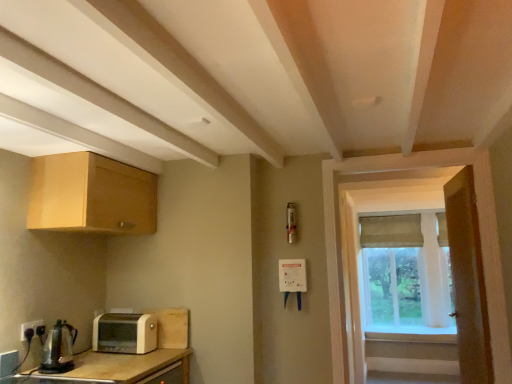
What do you see at coordinates (339, 230) in the screenshot? The height and width of the screenshot is (384, 512). I see `wooden screen door at right` at bounding box center [339, 230].

Where is `white plastic toaster at lower left`? white plastic toaster at lower left is located at coordinates (125, 333).

Locate an element on the screen. This screenshot has width=512, height=384. green fabric curtain at right is located at coordinates (406, 274).

What do you see at coordinates (29, 327) in the screenshot? The width and height of the screenshot is (512, 384). I see `black plastic electrical outlet at lower left` at bounding box center [29, 327].

From the picture: In order to face wooden door at right, should I rotate leftwards or rightwards?

Rotate right and turn 25.791 degrees.

What do you see at coordinates (391, 231) in the screenshot? The image size is (512, 384). I see `beige fabric curtain at window` at bounding box center [391, 231].

This screenshot has width=512, height=384. What do you see at coordinates (58, 349) in the screenshot? I see `translucent glass kettle at lower left` at bounding box center [58, 349].

In order to click on wooden screen door at right in this screenshot , I will do `click(339, 230)`.

Can we say translucent glass kettle at lower left lies outside light wood cabinet at upper left?

translucent glass kettle at lower left is positioned outside light wood cabinet at upper left.

How distant is translucent glass kettle at lower left from light wood cabinet at upper left?

translucent glass kettle at lower left is 28.16 inches away from light wood cabinet at upper left.

Where is `coffee machine below the light wood cabinet at upper left (from the image's perspective)`? This screenshot has width=512, height=384. coffee machine below the light wood cabinet at upper left (from the image's perspective) is located at coordinates click(58, 349).

Considering the relative sizes of translucent glass kettle at lower left and light wood cabinet at upper left in the image provided, is translucent glass kettle at lower left thinner than light wood cabinet at upper left?

Correct, the width of translucent glass kettle at lower left is less than that of light wood cabinet at upper left.

How different are the orientations of wooden screen door at right and green fabric curtain at right in degrees?

wooden screen door at right and green fabric curtain at right are facing 4.34 degrees away from each other.

Which is more to the left, wooden screen door at right or green fabric curtain at right?

Positioned to the left is wooden screen door at right.

Is wooden screen door at right with green fabric curtain at right?

No, wooden screen door at right is not touching green fabric curtain at right.

Is wooden screen door at right shorter than green fabric curtain at right?

Indeed, wooden screen door at right has a lesser height compared to green fabric curtain at right.

Is light wood cabinet at upper left looking in the opposite direction of wooden door at right?

light wood cabinet at upper left does not have its back to wooden door at right.

Is light wood cabinet at upper left in front of wooden door at right?

Yes.

Considering the relative sizes of light wood cabinet at upper left and wooden door at right in the image provided, is light wood cabinet at upper left wider than wooden door at right?

Indeed, light wood cabinet at upper left has a greater width compared to wooden door at right.

Is point (102, 196) closer or farther from the camera than point (459, 325)?

Point (102, 196).

Considering the sizes of green fabric curtain at right and light wood cabinet at upper left in the image, is green fabric curtain at right wider or thinner than light wood cabinet at upper left?

green fabric curtain at right is thinner than light wood cabinet at upper left.

Is green fabric curtain at right smaller than light wood cabinet at upper left?

No, green fabric curtain at right is not smaller than light wood cabinet at upper left.

From a real-world perspective, is green fabric curtain at right above or below light wood cabinet at upper left?

In terms of real-world spatial position, green fabric curtain at right is below light wood cabinet at upper left.

Is translucent glass kettle at lower left facing towards wooden screen door at right?

Yes, translucent glass kettle at lower left is facing wooden screen door at right.

Can you confirm if translucent glass kettle at lower left is positioned to the right of wooden screen door at right?

No, translucent glass kettle at lower left is not to the right of wooden screen door at right.

Which is in front, point (72, 359) or point (469, 159)?

The point (72, 359) is in front.

I want to click on coffee machine in front of the wooden screen door at right, so click(58, 349).

Does point (29, 327) lie behind point (145, 173)?

That is False.

Is black plastic electrical outlet at lower left spatially inside light wood cabinet at upper left, or outside of it?

black plastic electrical outlet at lower left is not enclosed by light wood cabinet at upper left.

Considering the sizes of black plastic electrical outlet at lower left and light wood cabinet at upper left in the image, is black plastic electrical outlet at lower left wider or thinner than light wood cabinet at upper left?

Considering their sizes, black plastic electrical outlet at lower left looks slimmer than light wood cabinet at upper left.

Considering the relative positions of black plastic electrical outlet at lower left and light wood cabinet at upper left in the image provided, is black plastic electrical outlet at lower left to the left or to the right of light wood cabinet at upper left?

From the image, it's evident that black plastic electrical outlet at lower left is to the left of light wood cabinet at upper left.

In terms of height, does black plastic electrical outlet at lower left look taller or shorter compared to translucent glass kettle at lower left?

In the image, black plastic electrical outlet at lower left appears to be shorter than translucent glass kettle at lower left.

In the image, there is a black plastic electrical outlet at lower left. Identify the location of coffee machine below it (from the image's perspective). This screenshot has width=512, height=384. (58, 349).

Between black plastic electrical outlet at lower left and translucent glass kettle at lower left, which one is positioned in front?

translucent glass kettle at lower left.

From a real-world perspective, is black plastic electrical outlet at lower left above or below translucent glass kettle at lower left?

In terms of real-world spatial position, black plastic electrical outlet at lower left is above translucent glass kettle at lower left.

The height and width of the screenshot is (384, 512). I want to click on cabinetry behind the translucent glass kettle at lower left, so click(x=91, y=195).

Locate an element on the screen. This screenshot has width=512, height=384. window that is below the wooden screen door at right (from the image's perspective) is located at coordinates (406, 274).

When comparing their distances from wooden door at right, does translucent glass kettle at lower left or wooden screen door at right seem further?

translucent glass kettle at lower left.

Looking at the image, which one is located further to wooden door at right, translucent glass kettle at lower left or beige fabric curtain at window?

translucent glass kettle at lower left is positioned further to the anchor wooden door at right.

Looking at this image, considering their positions, is wooden door at right positioned further to light wood cabinet at upper left than beige fabric curtain at window?

Among the two, beige fabric curtain at window is located further to light wood cabinet at upper left.

Which object lies nearer to the anchor point light wood cabinet at upper left, wooden screen door at right or wooden door at right?

wooden screen door at right lies closer to light wood cabinet at upper left than the other object.

When comparing their distances from wooden screen door at right, does translucent glass kettle at lower left or light wood cabinet at upper left seem closer?

Based on the image, light wood cabinet at upper left appears to be nearer to wooden screen door at right.

Estimate the real-world distances between objects in this image. Which object is closer to green fabric curtain at right, beige fabric curtain at window or wooden door at right?

Among the two, beige fabric curtain at window is located nearer to green fabric curtain at right.

Based on the photo, from the image, which object appears to be nearer to wooden door at right, white plastic toaster at lower left or beige fabric curtain at window?

white plastic toaster at lower left is positioned closer to the anchor wooden door at right.

Which object lies nearer to the anchor point wooden door at right, black plastic electrical outlet at lower left or beige fabric curtain at window?

The object closer to wooden door at right is beige fabric curtain at window.

Identify the location of kitchen appliance between translucent glass kettle at lower left and green fabric curtain at right along the z-axis. Image resolution: width=512 pixels, height=384 pixels. (125, 333).

What are the coordinates of `door positioned between translucent glass kettle at lower left and beige fabric curtain at window from near to far` in the screenshot? It's located at (468, 279).

The image size is (512, 384). Find the location of `kitchen appliance positioned between wooden screen door at right and beige fabric curtain at window from near to far`. kitchen appliance positioned between wooden screen door at right and beige fabric curtain at window from near to far is located at coordinates pos(125,333).

Locate an element on the screen. The image size is (512, 384). kitchen appliance between translucent glass kettle at lower left and wooden screen door at right from left to right is located at coordinates (125, 333).